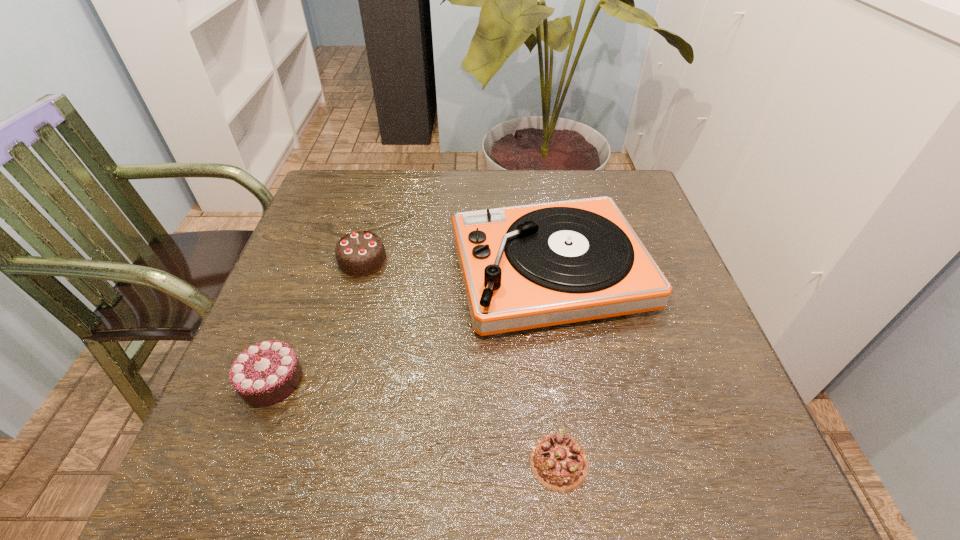
Where is `the tallest object`? This screenshot has width=960, height=540. the tallest object is located at coordinates (523, 267).

You are a GUI agent. You are given a task and a screenshot of the screen. Output one action in this format:
    pyautogui.click(x=<x>, y=<y>)
    Task: Click on the farthest chocolate cake
    This screenshot has width=960, height=540.
    Given the screenshot: What is the action you would take?
    pyautogui.click(x=361, y=253)

This screenshot has width=960, height=540. Identify the location of the third farthest object. (265, 373).

Locate an element on the screen. The width and height of the screenshot is (960, 540). the second shortest object is located at coordinates (265, 373).

The image size is (960, 540). What are the coordinates of `the rightmost chocolate cake` in the screenshot? It's located at (559, 462).

Image resolution: width=960 pixels, height=540 pixels. Identify the location of the nearest object. (559, 462).

Where is `free space located 0.060m on the back of the record player`? This screenshot has height=540, width=960. free space located 0.060m on the back of the record player is located at coordinates (539, 204).

Image resolution: width=960 pixels, height=540 pixels. Find the location of `free space located on the left of the farthest chocolate cake`. free space located on the left of the farthest chocolate cake is located at coordinates (309, 261).

At what (x,y) coordinates should I click in order to perform the action: click on vacant space located on the front of the third tallest object. Please return your answer as a coordinate pair (x, y). Image resolution: width=960 pixels, height=540 pixels. Looking at the image, I should click on (241, 460).

Locate an element on the screen. The width and height of the screenshot is (960, 540). vacant region located on the right of the shortest chocolate cake is located at coordinates (740, 462).